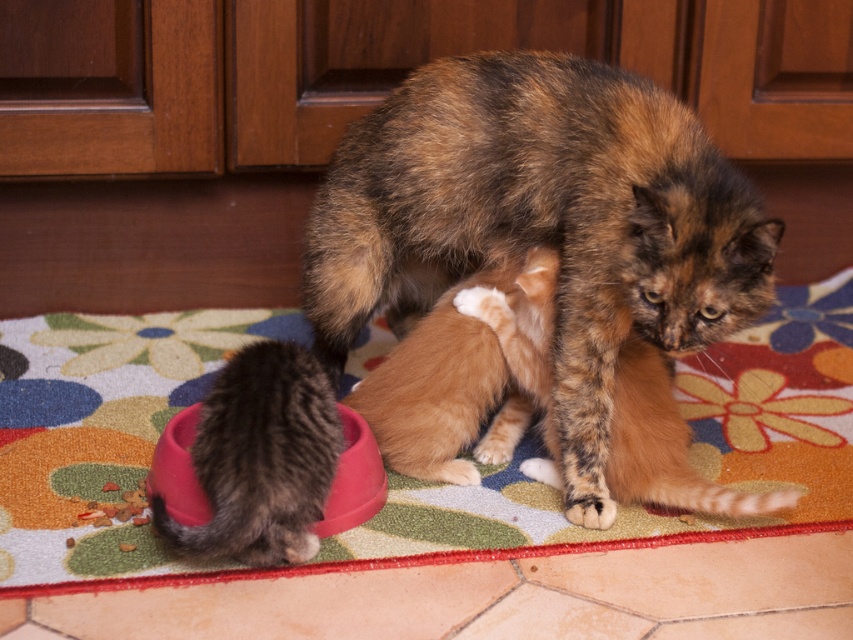
Is floral carpet at center thinner than soft fur paw at lower center?

No, floral carpet at center is not thinner than soft fur paw at lower center.

The height and width of the screenshot is (640, 853). Identify the location of floral carpet at center. (689, 456).

Locate an element on the screen. floral carpet at center is located at coordinates point(689,456).

Can you confirm if fluffy tortoiseshell cat at center is shorter than soft fur paw at lower center?

No, fluffy tortoiseshell cat at center is not shorter than soft fur paw at lower center.

Between point (279, 529) and point (596, 499), which one is positioned behind?

Point (596, 499)

Which is in front, point (358, 273) or point (596, 524)?

Point (596, 524) is in front.

In order to click on fluffy tortoiseshell cat at center in this screenshot , I will do `click(485, 264)`.

Does fluffy tortoiseshell cat at center appear over floral carpet at center?

Correct, fluffy tortoiseshell cat at center is located above floral carpet at center.

Which is behind, point (637, 134) or point (845, 272)?

Point (845, 272)

Identify the location of fluffy tortoiseshell cat at center. The image size is (853, 640). (485, 264).